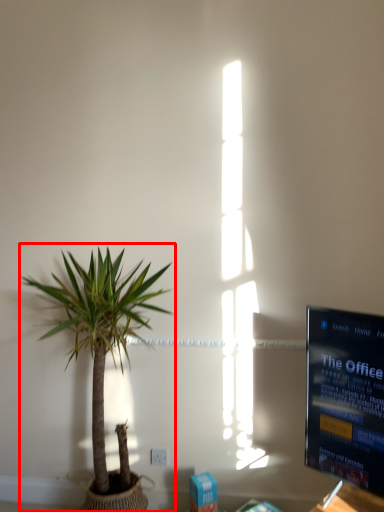
Question: Observing the image, what is the correct spatial positioning of houseplant (annotated by the red box) in reference to electric outlet?

Choices:
 (A) right
 (B) left

Answer: (B)